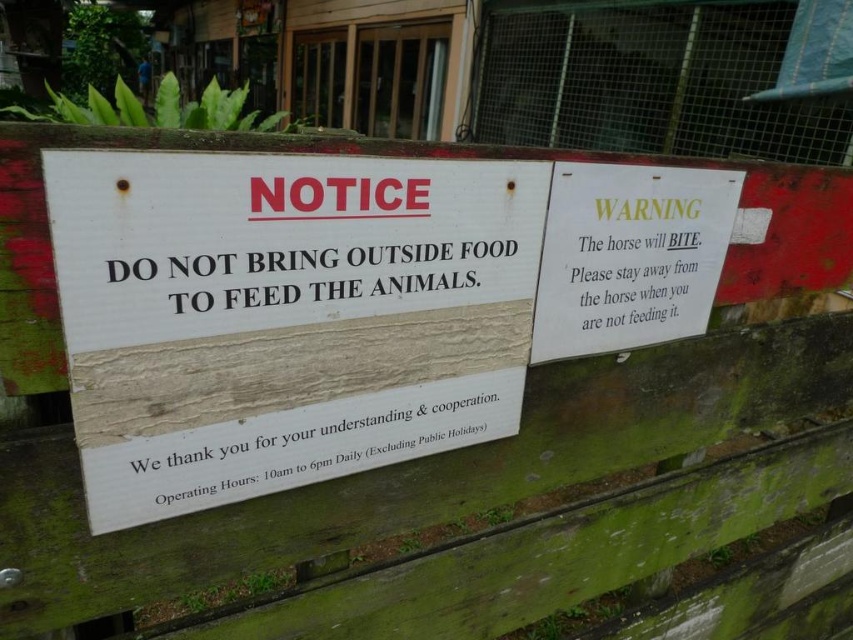
Is white wood sign at upper left smaller than white paper warning at upper right?

No.

Does white wood sign at upper left appear under white paper warning at upper right?

Yes.

Who is more forward, (358, 340) or (656, 173)?

Positioned in front is point (358, 340).

The image size is (853, 640). Find the location of `white wood sign at upper left`. white wood sign at upper left is located at coordinates (283, 316).